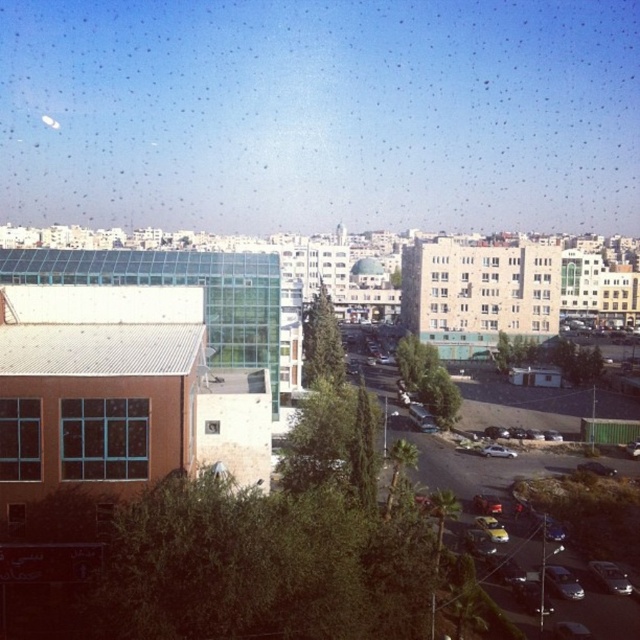
Question: Can you confirm if brown matte window at lower left is wider than satin silver sedan at lower right?

Choices:
 (A) yes
 (B) no

Answer: (B)

Question: Which point is closer to the camera taking this photo?

Choices:
 (A) (113, 442)
 (B) (556, 592)
 (C) (508, 452)

Answer: (A)

Question: Which object appears farthest from the camera in this image?

Choices:
 (A) shiny silver car at lower right
 (B) brown matte window at lower left
 (C) brown glass window at left

Answer: (A)

Question: Does brown glass window at left appear on the right side of silver metallic car at lower right?

Choices:
 (A) yes
 (B) no

Answer: (B)

Question: Which point appears closest to the camera in this image?

Choices:
 (A) (481, 451)
 (B) (600, 579)
 (C) (20, 456)

Answer: (C)

Question: Can you confirm if brown glass window at left is positioned to the left of shiny silver car at lower right?

Choices:
 (A) yes
 (B) no

Answer: (A)